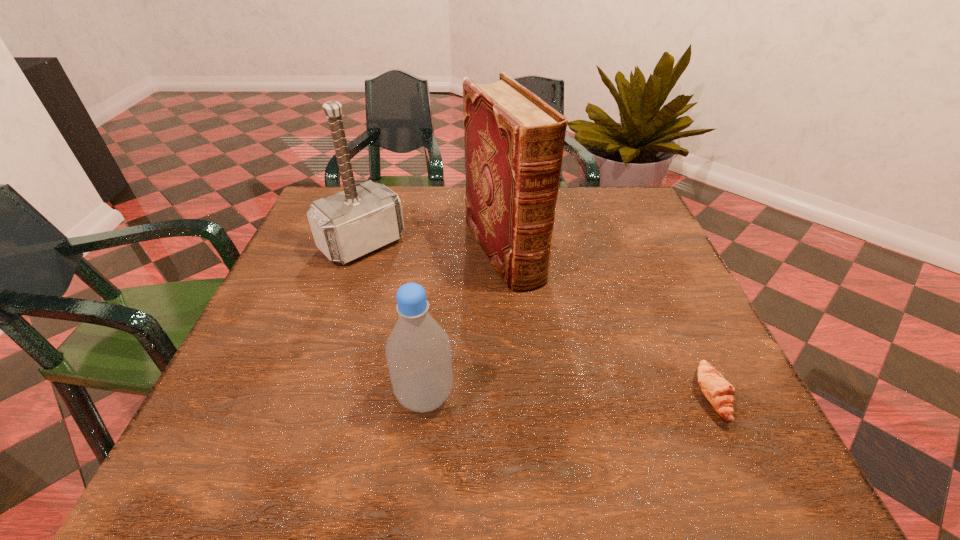
You are a GUI agent. You are given a task and a screenshot of the screen. Output one action in this format:
    pyautogui.click(x=<x>, y=<y>)
    Task: Click on the vacant space on the desktop that is between the bottle and the shortest object and is positioned for striking with the head of the hammer
    The image size is (960, 540).
    Given the screenshot: What is the action you would take?
    pyautogui.click(x=532, y=396)

Locate an element on the screen. Image resolution: width=960 pixels, height=540 pixels. vacant spot on the desktop that is between the third object from right to left and the rightmost object and is positioned on the spine side of the hardback book is located at coordinates (607, 396).